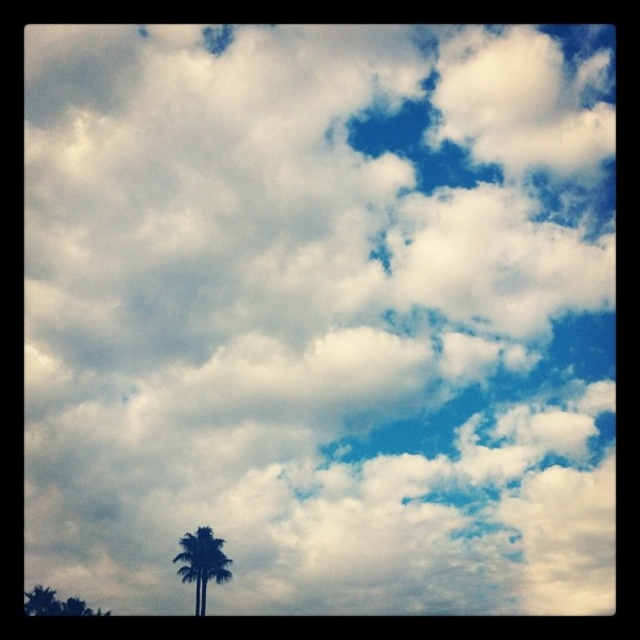
Question: Which of the following is the closest to the observer?

Choices:
 (A) green leafy tree at lower left
 (B) green leafy palm tree at lower center

Answer: (B)

Question: Which point appears closest to the camera in this image?

Choices:
 (A) (45, 589)
 (B) (195, 538)

Answer: (B)

Question: Can you confirm if green leafy palm tree at lower center is wider than green leafy tree at lower left?

Choices:
 (A) yes
 (B) no

Answer: (A)

Question: Is green leafy palm tree at lower center wider than green leafy tree at lower left?

Choices:
 (A) no
 (B) yes

Answer: (B)

Question: Among these objects, which one is farthest from the camera?

Choices:
 (A) green leafy tree at lower left
 (B) green leafy palm tree at lower center

Answer: (A)

Question: Is green leafy palm tree at lower center smaller than green leafy tree at lower left?

Choices:
 (A) no
 (B) yes

Answer: (A)